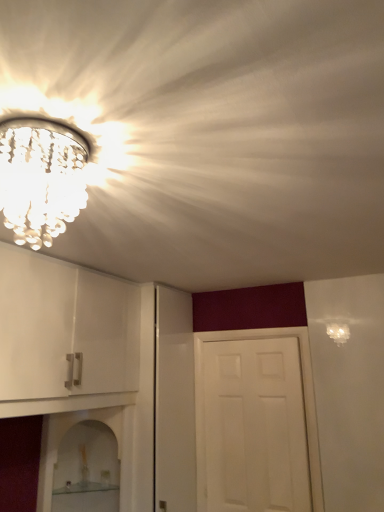
Describe the element at coordinates (85, 487) in the screenshot. I see `clear glass shelf at lower left, marked as the second shelf in a top-to-bottom arrangement` at that location.

What do you see at coordinates (64, 435) in the screenshot? I see `clear glass shelf at lower center, positioned as the second shelf in bottom-to-top order` at bounding box center [64, 435].

This screenshot has height=512, width=384. In order to click on clear glass shelf at lower left, marked as the second shelf in a top-to-bottom arrangement in this screenshot , I will do `click(85, 487)`.

Considering the sizes of objects white matte door at center and clear glass shelf at lower left, marked as the second shelf in a top-to-bottom arrangement, in the image provided, who is taller, white matte door at center or clear glass shelf at lower left, marked as the second shelf in a top-to-bottom arrangement,?

With more height is white matte door at center.

From the picture: Is white matte door at center positioned behind clear glass shelf at lower left, the 1th shelf in the bottom-to-top sequence?

Yes, white matte door at center is further from the camera.

Considering the positions of objects white matte door at center and clear glass shelf at lower left, marked as the second shelf in a top-to-bottom arrangement, in the image provided, who is more to the right, white matte door at center or clear glass shelf at lower left, marked as the second shelf in a top-to-bottom arrangement,?

Positioned to the right is white matte door at center.

Can you tell me how much clear glass shelf at lower left, marked as the second shelf in a top-to-bottom arrangement, and white matte door at center differ in facing direction?

clear glass shelf at lower left, marked as the second shelf in a top-to-bottom arrangement, and white matte door at center are facing 91.1 degrees away from each other.

Can we say clear glass shelf at lower left, marked as the second shelf in a top-to-bottom arrangement, lies outside white matte door at center?

That's correct, clear glass shelf at lower left, marked as the second shelf in a top-to-bottom arrangement, is outside of white matte door at center.

The width and height of the screenshot is (384, 512). I want to click on the 1st shelf in front of the white matte door at center, starting your count from the anchor, so click(x=85, y=487).

Are clear glass shelf at lower left, the 1th shelf in the bottom-to-top sequence, and white matte door at center far apart?

No, clear glass shelf at lower left, the 1th shelf in the bottom-to-top sequence, is in close proximity to white matte door at center.

Between point (318, 461) and point (44, 468), which one is positioned in front?

Point (44, 468)

Considering the sizes of objects white matte door at center and clear glass shelf at lower center, positioned as the second shelf in bottom-to-top order, in the image provided, who is taller, white matte door at center or clear glass shelf at lower center, positioned as the second shelf in bottom-to-top order,?

Standing taller between the two is white matte door at center.

Is clear glass shelf at lower center, positioned as the second shelf in bottom-to-top order, located within white matte door at center?

No, clear glass shelf at lower center, positioned as the second shelf in bottom-to-top order, is not inside white matte door at center.

Considering the relative sizes of white matte door at center and clear glass shelf at lower center, the 1th shelf positioned from the top, in the image provided, is white matte door at center bigger than clear glass shelf at lower center, the 1th shelf positioned from the top,?

Correct, white matte door at center is larger in size than clear glass shelf at lower center, the 1th shelf positioned from the top.

Considering the relative positions of clear crystal chandelier at upper left and white matte door at center in the image provided, is clear crystal chandelier at upper left to the left of white matte door at center from the viewer's perspective?

Correct, you'll find clear crystal chandelier at upper left to the left of white matte door at center.

From a real-world perspective, which object stands above the other?

clear crystal chandelier at upper left.

Which object is further away from the camera taking this photo, clear crystal chandelier at upper left or white matte door at center?

white matte door at center.

Between clear crystal chandelier at upper left and white matte door at center, which one has smaller size?

Smaller between the two is clear crystal chandelier at upper left.

Which is less distant, (129, 502) or (91, 490)?

The point (129, 502) is more forward.

From the image's perspective, is clear glass shelf at lower center, positioned as the second shelf in bottom-to-top order, above or below clear glass shelf at lower left, the 1th shelf in the bottom-to-top sequence?

clear glass shelf at lower center, positioned as the second shelf in bottom-to-top order, is situated higher than clear glass shelf at lower left, the 1th shelf in the bottom-to-top sequence, in the image.

Considering the sizes of objects clear glass shelf at lower center, the 1th shelf positioned from the top, and clear glass shelf at lower left, marked as the second shelf in a top-to-bottom arrangement, in the image provided, who is wider, clear glass shelf at lower center, the 1th shelf positioned from the top, or clear glass shelf at lower left, marked as the second shelf in a top-to-bottom arrangement,?

clear glass shelf at lower center, the 1th shelf positioned from the top.

From a real-world perspective, is clear glass shelf at lower center, the 1th shelf positioned from the top, above or below clear glass shelf at lower left, the 1th shelf in the bottom-to-top sequence?

Clearly, from a real-world perspective, clear glass shelf at lower center, the 1th shelf positioned from the top, is above clear glass shelf at lower left, the 1th shelf in the bottom-to-top sequence.

Is clear crystal chandelier at upper left with clear glass shelf at lower left, marked as the second shelf in a top-to-bottom arrangement?

No.

Is clear crystal chandelier at upper left at the left side of clear glass shelf at lower left, the 1th shelf in the bottom-to-top sequence?

In fact, clear crystal chandelier at upper left is to the right of clear glass shelf at lower left, the 1th shelf in the bottom-to-top sequence.

The height and width of the screenshot is (512, 384). I want to click on light fixture lying in front of the clear glass shelf at lower left, the 1th shelf in the bottom-to-top sequence, so click(x=41, y=178).

Is clear crystal chandelier at upper left wider or thinner than clear glass shelf at lower left, the 1th shelf in the bottom-to-top sequence?

Considering their sizes, clear crystal chandelier at upper left looks slimmer than clear glass shelf at lower left, the 1th shelf in the bottom-to-top sequence.

Is white matte door at center at the left side of clear crystal chandelier at upper left?

Incorrect, white matte door at center is not on the left side of clear crystal chandelier at upper left.

Between point (241, 335) and point (15, 140), which one is positioned behind?

The point (241, 335) is behind.

Is white matte door at center wider than clear crystal chandelier at upper left?

No, white matte door at center is not wider than clear crystal chandelier at upper left.

Where is `the 1st shelf in front of the white matte door at center, starting your count from the anchor`? The image size is (384, 512). the 1st shelf in front of the white matte door at center, starting your count from the anchor is located at coordinates (85, 487).

Locate an element on the screen. Image resolution: width=384 pixels, height=512 pixels. door behind the clear glass shelf at lower left, marked as the second shelf in a top-to-bottom arrangement is located at coordinates (x=303, y=395).

Based on the photo, estimate the real-world distances between objects in this image. Which object is further from clear glass shelf at lower center, the 1th shelf positioned from the top, white matte door at center or clear crystal chandelier at upper left?

Among the two, clear crystal chandelier at upper left is located further to clear glass shelf at lower center, the 1th shelf positioned from the top.

Based on their spatial positions, is clear glass shelf at lower left, the 1th shelf in the bottom-to-top sequence, or clear crystal chandelier at upper left closer to clear glass shelf at lower center, the 1th shelf positioned from the top?

clear glass shelf at lower left, the 1th shelf in the bottom-to-top sequence, is positioned closer to the anchor clear glass shelf at lower center, the 1th shelf positioned from the top.

Considering their positions, is white matte door at center positioned further to clear glass shelf at lower left, marked as the second shelf in a top-to-bottom arrangement, than clear glass shelf at lower center, the 1th shelf positioned from the top?

Based on the image, white matte door at center appears to be further to clear glass shelf at lower left, marked as the second shelf in a top-to-bottom arrangement.

Consider the image. Based on their spatial positions, is clear glass shelf at lower center, positioned as the second shelf in bottom-to-top order, or clear crystal chandelier at upper left closer to white matte door at center?

clear glass shelf at lower center, positioned as the second shelf in bottom-to-top order, is positioned closer to the anchor white matte door at center.

Estimate the real-world distances between objects in this image. Which object is further from clear glass shelf at lower left, the 1th shelf in the bottom-to-top sequence, clear crystal chandelier at upper left or white matte door at center?

clear crystal chandelier at upper left is further to clear glass shelf at lower left, the 1th shelf in the bottom-to-top sequence.

Based on their spatial positions, is clear glass shelf at lower center, the 1th shelf positioned from the top, or white matte door at center further from clear glass shelf at lower left, the 1th shelf in the bottom-to-top sequence?

white matte door at center lies further to clear glass shelf at lower left, the 1th shelf in the bottom-to-top sequence, than the other object.

Based on their spatial positions, is clear glass shelf at lower left, marked as the second shelf in a top-to-bottom arrangement, or clear glass shelf at lower center, positioned as the second shelf in bottom-to-top order, closer to clear crystal chandelier at upper left?

Among the two, clear glass shelf at lower center, positioned as the second shelf in bottom-to-top order, is located nearer to clear crystal chandelier at upper left.

Which object lies nearer to the anchor point clear glass shelf at lower left, the 1th shelf in the bottom-to-top sequence, white matte door at center or clear crystal chandelier at upper left?

Based on the image, white matte door at center appears to be nearer to clear glass shelf at lower left, the 1th shelf in the bottom-to-top sequence.

The height and width of the screenshot is (512, 384). Identify the location of shelf between clear crystal chandelier at upper left and clear glass shelf at lower left, marked as the second shelf in a top-to-bottom arrangement, from top to bottom. (64, 435).

I want to click on shelf situated between clear glass shelf at lower left, marked as the second shelf in a top-to-bottom arrangement, and white matte door at center from left to right, so tap(64, 435).